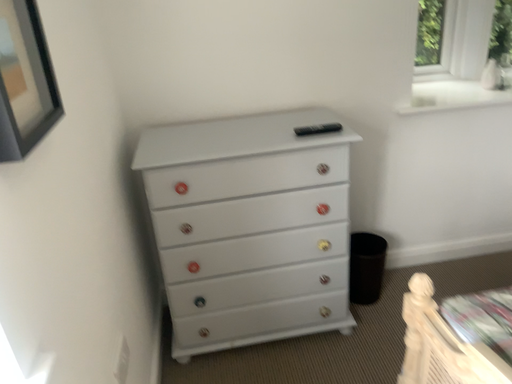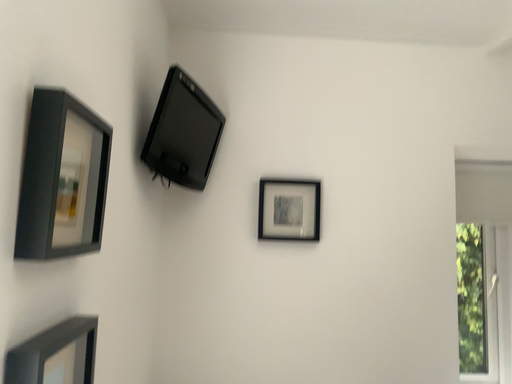
Question: Which way did the camera rotate in the video?

Choices:
 (A) rotated downward
 (B) rotated upward

Answer: (B)